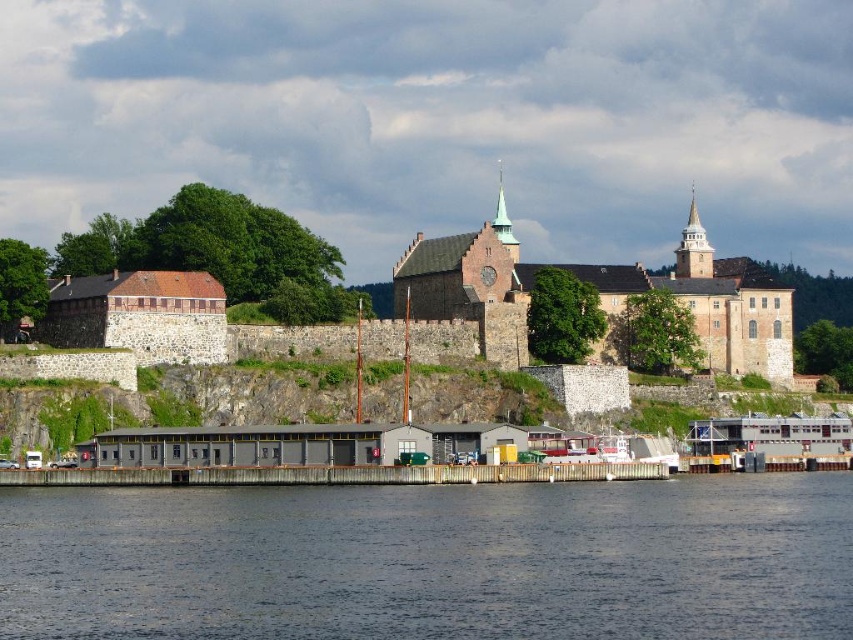
Question: Can you confirm if dark blue water at lower center is smaller than brown stone fort at center?

Choices:
 (A) no
 (B) yes

Answer: (B)

Question: Does dark blue water at lower center appear over brown stone fort at center?

Choices:
 (A) no
 (B) yes

Answer: (A)

Question: Which of the following is the farthest from the observer?

Choices:
 (A) (769, 365)
 (B) (672, 480)

Answer: (A)

Question: Which point appears closest to the camera in this image?

Choices:
 (A) (498, 570)
 (B) (712, 355)

Answer: (A)

Question: Which of the following is the closest to the observer?

Choices:
 (A) (784, 307)
 (B) (448, 528)

Answer: (B)

Question: Does dark blue water at lower center come behind brown stone fort at center?

Choices:
 (A) no
 (B) yes

Answer: (A)